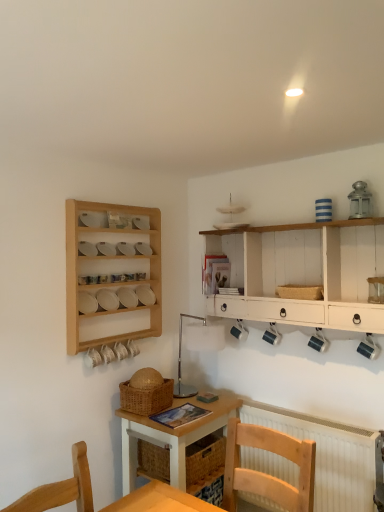
Locate an element on the screen. empty space that is ontop of wooden shelf at left (from a real-world perspective) is located at coordinates (114, 204).